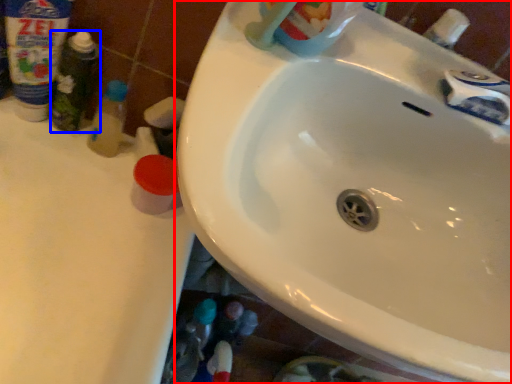
Question: Which object is closer to the camera taking this photo, sink (highlighted by a red box) or toiletry (highlighted by a blue box)?

Choices:
 (A) sink
 (B) toiletry

Answer: (A)